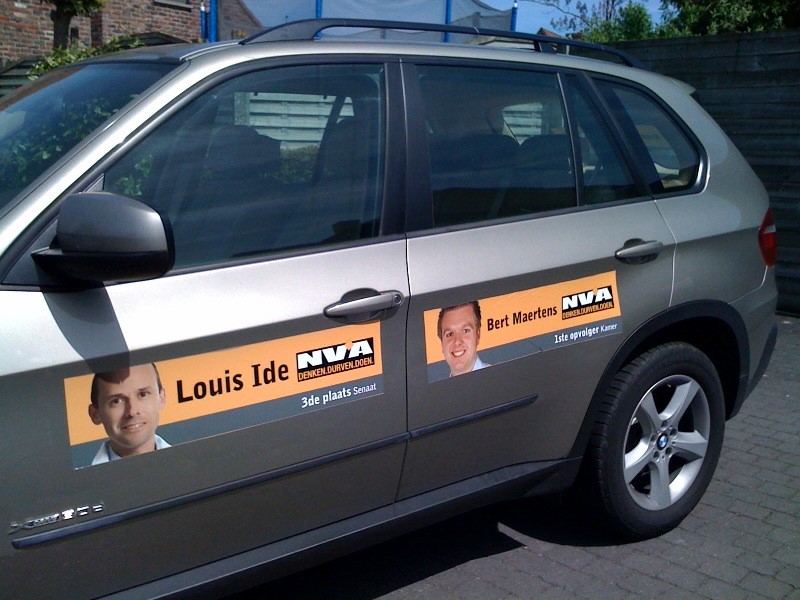
Find the location of a particular element. The image size is (800, 600). seat is located at coordinates (333, 151), (224, 150).